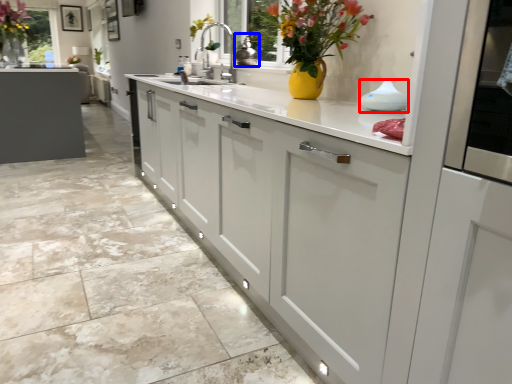
Question: Which object is further to the camera taking this photo, appliance (highlighted by a red box) or appliance (highlighted by a blue box)?

Choices:
 (A) appliance
 (B) appliance

Answer: (B)